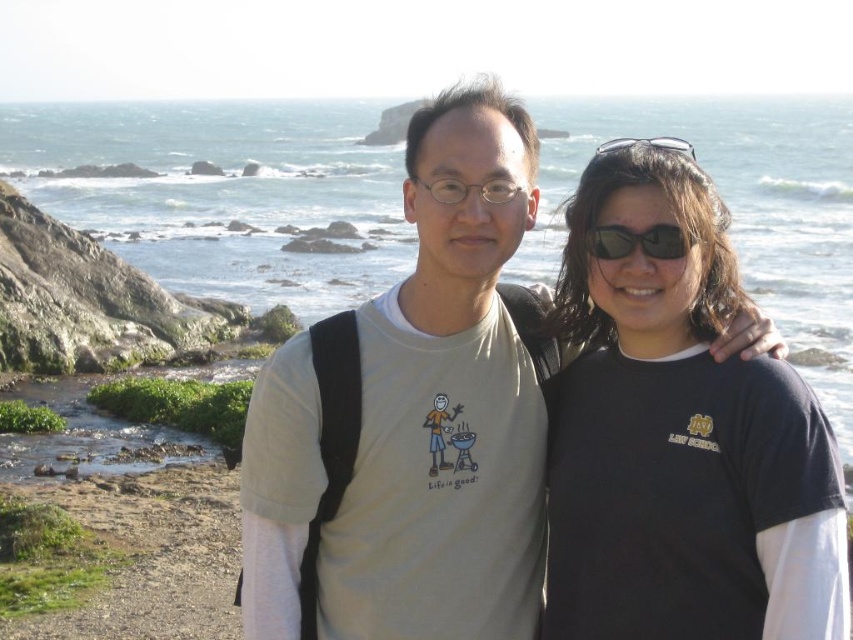
Who is taller, black matte t-shirt at center or beige cotton t-shirt at center?

beige cotton t-shirt at center is taller.

Between point (657, 198) and point (374, 612), which one is positioned in front?

Positioned in front is point (657, 198).

At what (x,y) coordinates should I click in order to perform the action: click on black matte t-shirt at center. Please return your answer as a coordinate pair (x, y). This screenshot has height=640, width=853. Looking at the image, I should click on (680, 440).

Is beige cotton t-shirt at center wider than sunglasses at center?

Correct, the width of beige cotton t-shirt at center exceeds that of sunglasses at center.

Who is shorter, beige cotton t-shirt at center or sunglasses at center?

With less height is sunglasses at center.

Does point (492, 97) lie behind point (660, 241)?

Yes, it is.

The height and width of the screenshot is (640, 853). What are the coordinates of `beige cotton t-shirt at center` in the screenshot? It's located at (445, 403).

What do you see at coordinates (680, 440) in the screenshot? This screenshot has height=640, width=853. I see `black matte t-shirt at center` at bounding box center [680, 440].

Between black matte t-shirt at center and clear plastic sunglasses at upper center, which one has more height?

clear plastic sunglasses at upper center

Where is `black matte t-shirt at center`? The height and width of the screenshot is (640, 853). black matte t-shirt at center is located at coordinates (680, 440).

Locate an element on the screen. black matte t-shirt at center is located at coordinates (680, 440).